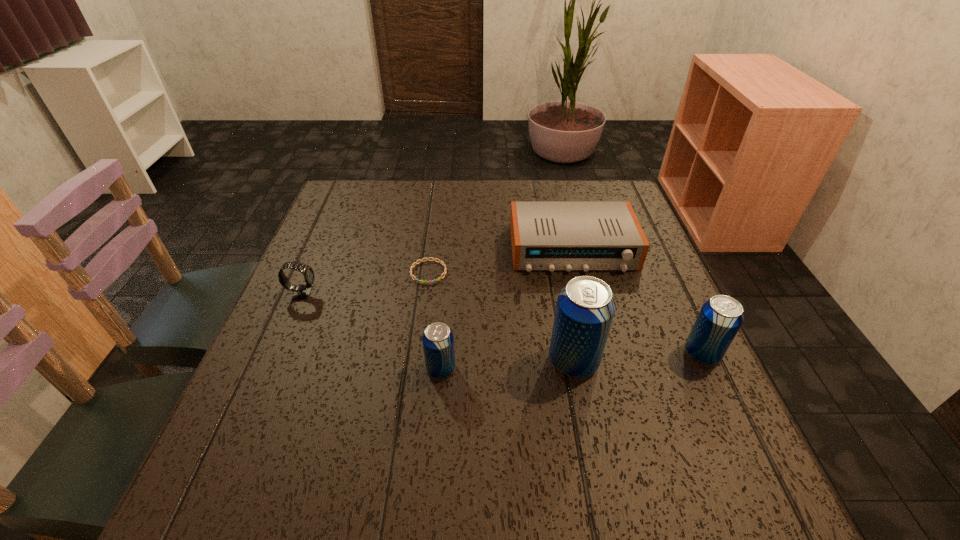
I want to click on the shortest beer can, so click(438, 340).

Locate an element on the screen. Image resolution: width=960 pixels, height=540 pixels. the leftmost beer can is located at coordinates coord(438,340).

The height and width of the screenshot is (540, 960). What are the coordinates of `the second beer can from left to right` in the screenshot? It's located at (585, 308).

You are a GUI agent. You are given a task and a screenshot of the screen. Output one action in this format:
    pyautogui.click(x=<x>, y=<y>)
    Task: Click on the tallest beer can
    
    Given the screenshot: What is the action you would take?
    pyautogui.click(x=585, y=308)

Find the location of a particular element. The image size is (960, 540). the rightmost object is located at coordinates pos(720,318).

Identify the location of the second shortest beer can. (720, 318).

Image resolution: width=960 pixels, height=540 pixels. I want to click on the shortest object, so click(x=427, y=259).

Identify the location of radio receiver. (551, 236).

This screenshot has height=540, width=960. I want to click on the leftmost object, so click(x=301, y=292).

I want to click on watch, so click(x=301, y=292).